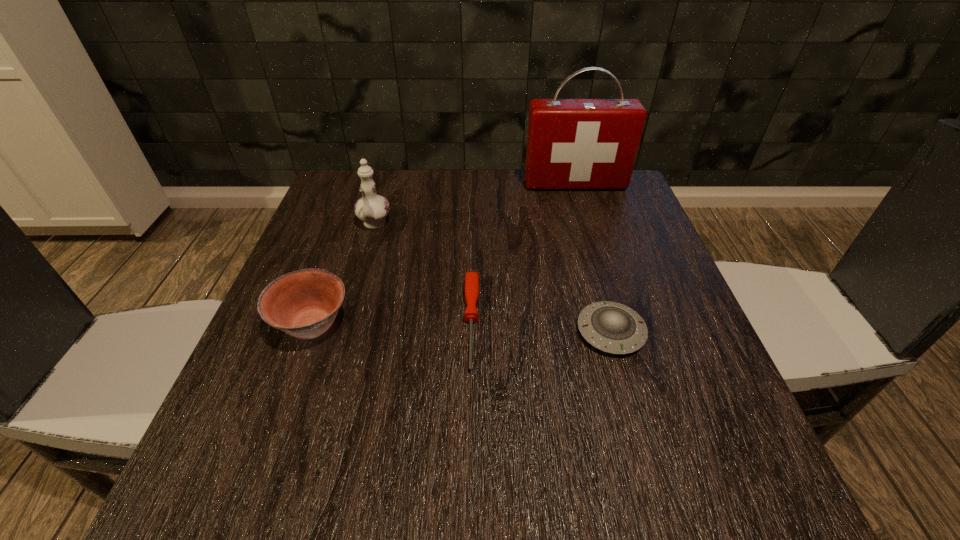
Where is `empty space that is in between the third object from right to left and the second farthest object`? This screenshot has height=540, width=960. empty space that is in between the third object from right to left and the second farthest object is located at coordinates (422, 274).

The width and height of the screenshot is (960, 540). Find the location of `vacant space in between the saucer and the screwdriver`. vacant space in between the saucer and the screwdriver is located at coordinates (541, 327).

This screenshot has height=540, width=960. I want to click on free space between the chinaware and the bowl, so point(344,275).

The height and width of the screenshot is (540, 960). What are the coordinates of `vacant area between the third tallest object and the third object from right to left` in the screenshot? It's located at (392, 323).

Find the location of a particular element. This screenshot has width=960, height=540. vacant area between the farthest object and the fourth nearest object is located at coordinates (474, 205).

This screenshot has height=540, width=960. I want to click on free point between the second farthest object and the first-aid kit, so point(474,205).

Where is `free space between the bowl and the saucer`? This screenshot has width=960, height=540. free space between the bowl and the saucer is located at coordinates coord(462,328).

At what (x,y) coordinates should I click in order to perform the action: click on free space between the tallest object and the third shortest object. Please return your answer as a coordinate pair (x, y). This screenshot has width=960, height=540. Looking at the image, I should click on (444, 254).

Identify which object is the third closest to the farthest object. Please provide its 2D coordinates. Your answer should be formatted as a tuple, i.e. [(x, y)], where the tuple contains the x and y coordinates of a point satisfying the conditions above.

[(611, 327)]

Identify which object is the nearest to the bowl. Please provide its 2D coordinates. Your answer should be formatted as a tuple, i.e. [(x, y)], where the tuple contains the x and y coordinates of a point satisfying the conditions above.

[(372, 209)]